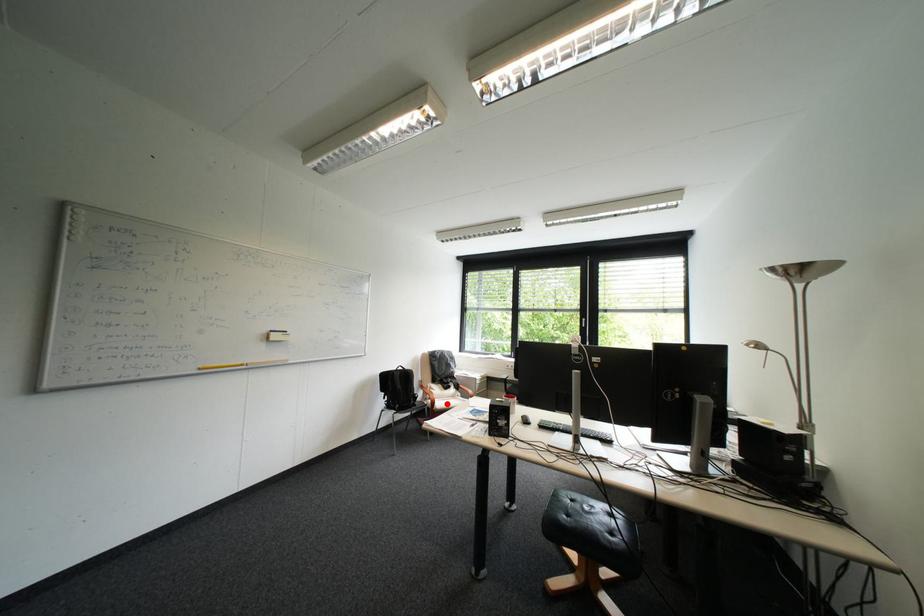
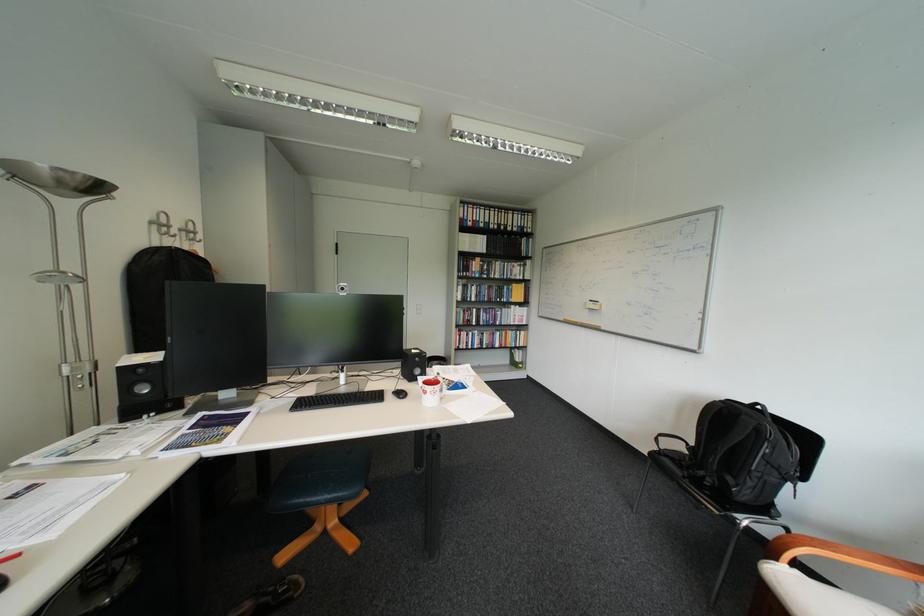
Question: I am providing you with two images of the same scene from different viewpoints. Image1 has a red point marked. In image2, the corresponding 3D location appears at what relative position? Reply with the corresponding letter.

Choices:
 (A) Closer
 (B) Farther

Answer: (A)